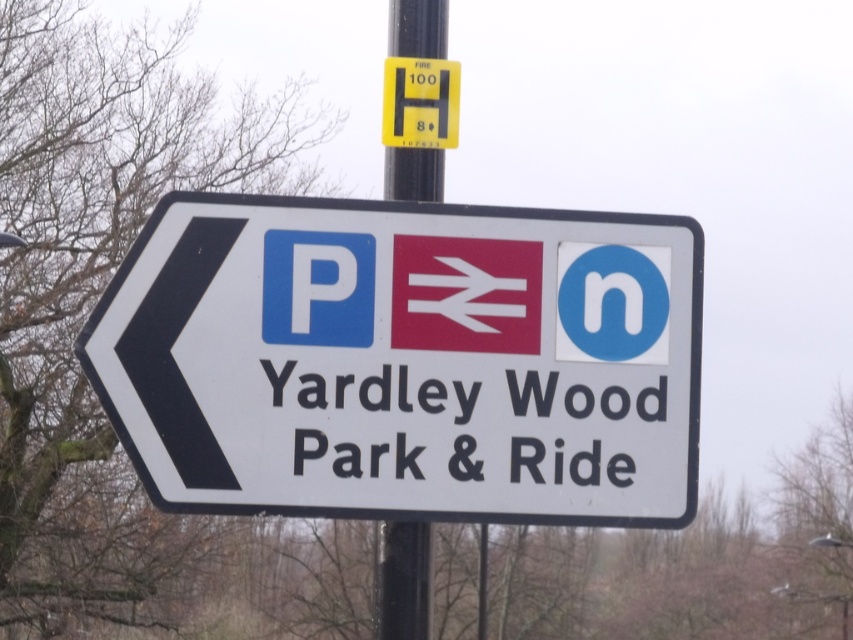
Is white plastic sign at center to the right of metallic pole at upper center from the viewer's perspective?

In fact, white plastic sign at center is to the left of metallic pole at upper center.

Where is `white plastic sign at center`? white plastic sign at center is located at coordinates click(405, 360).

Identify the location of white plastic sign at center. (405, 360).